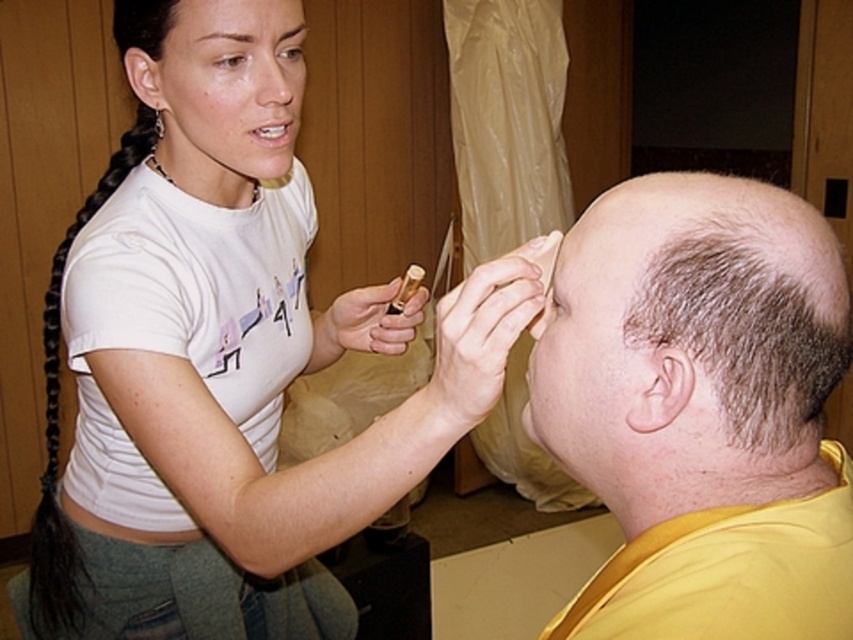
Question: Estimate the real-world distances between objects in this image. Which object is closer to the gray hair at upper center?

Choices:
 (A) dark brown hair at upper center
 (B) black braided hair at left
 (C) white matte t-shirt at upper left
 (D) matte white head at upper left

Answer: (C)

Question: Does white matte t-shirt at upper left have a larger size compared to bald head at upper right?

Choices:
 (A) yes
 (B) no

Answer: (A)

Question: Which point is farther to the camera?

Choices:
 (A) [x=279, y=252]
 (B) [x=244, y=44]
 (C) [x=136, y=51]
 (D) [x=819, y=323]

Answer: (A)

Question: Which object appears farthest from the camera in this image?

Choices:
 (A) matte white head at upper left
 (B) dark brown hair at upper center

Answer: (B)

Question: Is white matte t-shirt at upper left wider than bald head at upper right?

Choices:
 (A) yes
 (B) no

Answer: (A)

Question: Is bald head at upper right above matte white head at upper left?

Choices:
 (A) no
 (B) yes

Answer: (A)